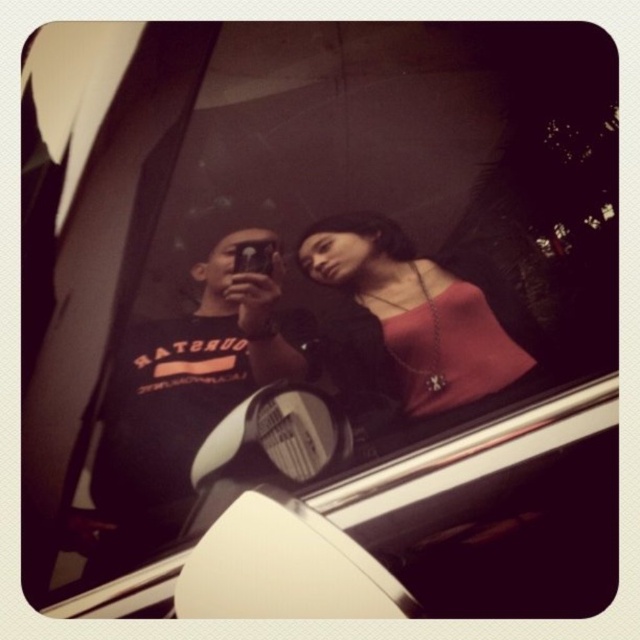
Question: Can you confirm if black matte t-shirt at center is positioned to the right of white plastic view mirror at center?

Choices:
 (A) no
 (B) yes

Answer: (A)

Question: Can you confirm if black matte t-shirt at center is positioned above white plastic view mirror at center?

Choices:
 (A) yes
 (B) no

Answer: (A)

Question: Among these points, which one is farthest from the camera?

Choices:
 (A) (483, 394)
 (B) (220, 424)
 (C) (156, 321)

Answer: (C)

Question: Does matte pink top at center have a smaller size compared to white plastic view mirror at center?

Choices:
 (A) yes
 (B) no

Answer: (B)

Question: Which point appears farthest from the camera in this image?

Choices:
 (A) (134, 477)
 (B) (312, 368)
 (C) (285, 432)

Answer: (B)

Question: Which object is the closest to the matte pink top at center?

Choices:
 (A) white plastic view mirror at center
 (B) black matte t-shirt at center

Answer: (A)